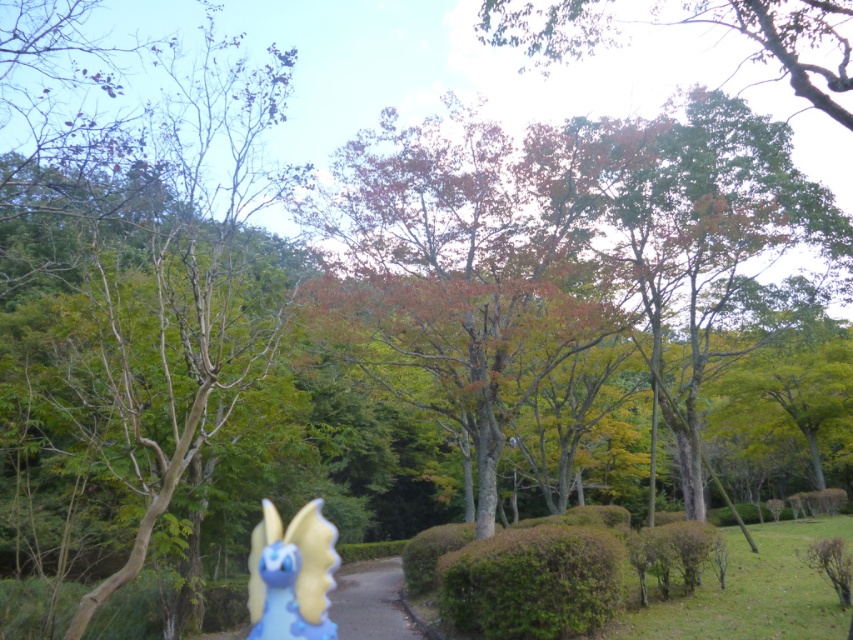
Question: Is brown matte tree at left thinner than blue matte figurine at lower left?

Choices:
 (A) no
 (B) yes

Answer: (A)

Question: Among these objects, which one is farthest from the camera?

Choices:
 (A) blue matte figurine at lower left
 (B) brown matte tree at left

Answer: (A)

Question: Which object is farther from the camera taking this photo?

Choices:
 (A) smooth asphalt path at center
 (B) green leafy tree at upper center

Answer: (A)

Question: Considering the relative positions of green textured hedge at center and smooth asphalt path at center in the image provided, where is green textured hedge at center located with respect to smooth asphalt path at center?

Choices:
 (A) above
 (B) below

Answer: (A)

Question: In this image, where is green leafy tree at upper center located relative to blue matte figurine at lower left?

Choices:
 (A) below
 (B) above

Answer: (B)

Question: Which point is farther from the camera taking this photo?

Choices:
 (A) (405, 552)
 (B) (209, 147)
 (C) (781, 51)

Answer: (B)